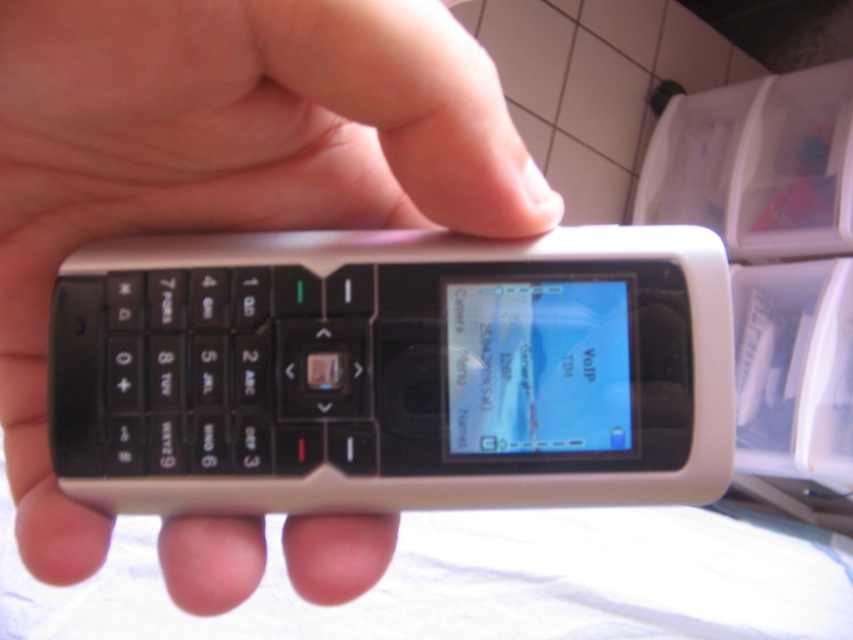
Question: Which object is farther from the camera taking this photo?

Choices:
 (A) white matte phone at center
 (B) silver matte phone at center

Answer: (B)

Question: Which of the following is the farthest from the observer?

Choices:
 (A) white matte phone at center
 (B) silver matte phone at center

Answer: (B)

Question: Is silver matte phone at center bigger than white matte phone at center?

Choices:
 (A) yes
 (B) no

Answer: (B)

Question: Is silver matte phone at center thinner than white matte phone at center?

Choices:
 (A) no
 (B) yes

Answer: (A)

Question: Which object appears closest to the camera in this image?

Choices:
 (A) silver matte phone at center
 (B) white matte phone at center

Answer: (B)

Question: Observing the image, what is the correct spatial positioning of silver matte phone at center in reference to white matte phone at center?

Choices:
 (A) right
 (B) left

Answer: (A)